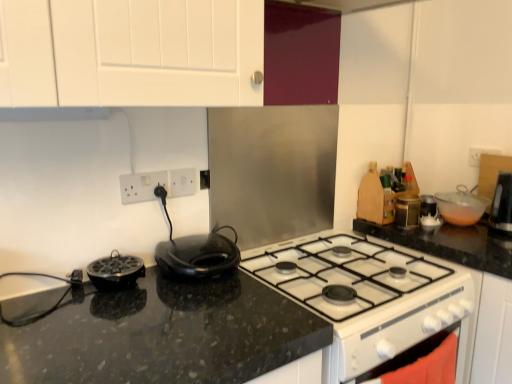
In order to face black granite countertop at center, should I rotate leftwards or rightwards?

To align with it, rotate right about 11.150°.

What do you see at coordinates (166, 335) in the screenshot? I see `black granite countertop at center` at bounding box center [166, 335].

This screenshot has width=512, height=384. In order to click on white glossy oven at lower right in this screenshot , I will do `click(409, 354)`.

Describe the element at coordinates (141, 186) in the screenshot. I see `white plastic electrical outlet at center-left, the 2th electric outlet in the right-to-left sequence` at that location.

This screenshot has width=512, height=384. What do you see at coordinates (115, 272) in the screenshot? I see `black matte waffle maker at lower left, arranged as the 3th kitchen appliance when viewed from the right` at bounding box center [115, 272].

Find the location of `black plastic toaster at center, positioned as the second kitchen appliance in left-to-right order`. black plastic toaster at center, positioned as the second kitchen appliance in left-to-right order is located at coordinates (198, 255).

From the image's perspective, is white plastic electric outlet at upper center, marked as the 1th electric outlet in a right-to-left arrangement, beneath white plastic electrical outlet at center-left, the 2th electric outlet in the right-to-left sequence?

Actually, white plastic electric outlet at upper center, marked as the 1th electric outlet in a right-to-left arrangement, appears above white plastic electrical outlet at center-left, the 2th electric outlet in the right-to-left sequence, in the image.

Does point (190, 189) appear closer or farther from the camera than point (164, 185)?

Point (190, 189).

Is white plastic electric outlet at upper center, the 2th electric outlet viewed from the left, facing towards white plastic electrical outlet at center-left, the 2th electric outlet in the right-to-left sequence?

No, white plastic electric outlet at upper center, the 2th electric outlet viewed from the left, is not facing towards white plastic electrical outlet at center-left, the 2th electric outlet in the right-to-left sequence.

How much distance is there between white plastic electric outlet at upper center, marked as the 1th electric outlet in a right-to-left arrangement, and white plastic electrical outlet at center-left, the 2th electric outlet in the right-to-left sequence?

white plastic electric outlet at upper center, marked as the 1th electric outlet in a right-to-left arrangement, and white plastic electrical outlet at center-left, the 2th electric outlet in the right-to-left sequence, are 8.40 centimeters apart from each other.

From the image's perspective, is black plastic toaster at center, arranged as the second kitchen appliance when viewed from the back, positioned above or below white frosted glass jar at upper right?

black plastic toaster at center, arranged as the second kitchen appliance when viewed from the back, is situated lower than white frosted glass jar at upper right in the image.

Between black plastic toaster at center, which is the second kitchen appliance from front to back, and white frosted glass jar at upper right, which one appears on the right side from the viewer's perspective?

white frosted glass jar at upper right.

How different are the orientations of black plastic toaster at center, arranged as the second kitchen appliance when viewed from the back, and white frosted glass jar at upper right in degrees?

The angular difference between black plastic toaster at center, arranged as the second kitchen appliance when viewed from the back, and white frosted glass jar at upper right is 90 degrees.

Which point is more distant from viewer, (194,257) or (431,216)?

The point (431,216) is behind.

Would you say black matte waffle maker at lower left, which is the first kitchen appliance from front to back, is a long distance from white plastic electrical outlet at center-left, the 2th electric outlet in the right-to-left sequence?

No, black matte waffle maker at lower left, which is the first kitchen appliance from front to back, is not far from white plastic electrical outlet at center-left, the 2th electric outlet in the right-to-left sequence.

From a real-world perspective, who is located lower, black matte waffle maker at lower left, which is the first kitchen appliance from front to back, or white plastic electrical outlet at center-left, the 2th electric outlet in the right-to-left sequence?

black matte waffle maker at lower left, which is the first kitchen appliance from front to back, is physically lower.

From the picture: Which object is wider, black matte waffle maker at lower left, arranged as the 3th kitchen appliance when viewed from the right, or white plastic electrical outlet at center-left, the first electric outlet positioned from the left?

Wider between the two is black matte waffle maker at lower left, arranged as the 3th kitchen appliance when viewed from the right.

Can you tell me how much black matte waffle maker at lower left, which ranks as the third kitchen appliance in back-to-front order, and white plastic electrical outlet at center-left, the 2th electric outlet in the right-to-left sequence, differ in facing direction?

The angular difference between black matte waffle maker at lower left, which ranks as the third kitchen appliance in back-to-front order, and white plastic electrical outlet at center-left, the 2th electric outlet in the right-to-left sequence, is 0.0012 degrees.

You are a GUI agent. You are given a task and a screenshot of the screen. Output one action in this format:
    pyautogui.click(x=<x>, y=<y>)
    Task: Click on the 1st electric outlet behind the white glossy oven at lower right, starting your count from the anchor
    Image resolution: width=512 pixels, height=384 pixels.
    Given the screenshot: What is the action you would take?
    pyautogui.click(x=141, y=186)

Which point is more distant from viewer, (372, 378) or (135, 198)?

The point (135, 198) is farther from the camera.

Is white glossy oven at lower right not near white plastic electrical outlet at center-left, the first electric outlet positioned from the left?

white glossy oven at lower right is near white plastic electrical outlet at center-left, the first electric outlet positioned from the left, not far away.

From a real-world perspective, which object stands above the other?

From a 3D spatial view, white plastic electrical outlet at center-left, the first electric outlet positioned from the left, is above.

Between black granite countertop at center and white plastic electrical outlet at center-left, the 2th electric outlet in the right-to-left sequence, which one is positioned in front?

white plastic electrical outlet at center-left, the 2th electric outlet in the right-to-left sequence, is closer to the camera.

In order to click on counter top below the white plastic electrical outlet at center-left, the 2th electric outlet in the right-to-left sequence (from a real-world perspective) in this screenshot , I will do `click(476, 286)`.

Could you tell me if black granite countertop at center is facing white plastic electrical outlet at center-left, the 2th electric outlet in the right-to-left sequence?

Yes, black granite countertop at center faces towards white plastic electrical outlet at center-left, the 2th electric outlet in the right-to-left sequence.

Would you say black granite countertop at center contains white plastic electrical outlet at center-left, the first electric outlet positioned from the left?

No, white plastic electrical outlet at center-left, the first electric outlet positioned from the left, is not a part of black granite countertop at center.

Considering the relative sizes of white glossy exhaust hood at upper center and white glossy oven at lower right in the image provided, is white glossy exhaust hood at upper center taller than white glossy oven at lower right?

No.

Considering the points (28, 108) and (368, 374), which point is in front, point (28, 108) or point (368, 374)?

Point (28, 108)

Based on the photo, from a real-world perspective, is white glossy exhaust hood at upper center below white glossy oven at lower right?

No, from a real-world perspective, white glossy exhaust hood at upper center is not under white glossy oven at lower right.

Which of these two, black plastic toaster at center, arranged as the second kitchen appliance when viewed from the back, or white plastic electric outlet at upper center, the 2th electric outlet viewed from the left, stands taller?

Standing taller between the two is white plastic electric outlet at upper center, the 2th electric outlet viewed from the left.

Is point (228, 257) positioned before point (192, 190)?

Yes, it is.

How much distance is there between black plastic toaster at center, which is the second kitchen appliance from front to back, and white plastic electric outlet at upper center, marked as the 1th electric outlet in a right-to-left arrangement?

8.61 inches.

Is the depth of black plastic toaster at center, which is the second kitchen appliance from front to back, greater than that of white plastic electric outlet at upper center, marked as the 1th electric outlet in a right-to-left arrangement?

No, it is not.

The height and width of the screenshot is (384, 512). I want to click on electric outlet behind the white plastic electrical outlet at center-left, the 2th electric outlet in the right-to-left sequence, so click(182, 182).

Starting from the white frosted glass jar at upper right, which kitchen appliance is the 1st one to the left? Please provide its 2D coordinates.

[(198, 255)]

When comparing their distances from white glossy exhaust hood at upper center, does white plastic electric outlet at upper center, marked as the 1th electric outlet in a right-to-left arrangement, or black granite countertop at center seem closer?

white plastic electric outlet at upper center, marked as the 1th electric outlet in a right-to-left arrangement, lies closer to white glossy exhaust hood at upper center than the other object.

Looking at the image, which one is located closer to white plastic electrical outlet at center-left, the 2th electric outlet in the right-to-left sequence, black plastic toaster at center, placed as the second kitchen appliance when sorted from right to left, or black matte waffle maker at lower left, which ranks as the third kitchen appliance in back-to-front order?

black matte waffle maker at lower left, which ranks as the third kitchen appliance in back-to-front order, is closer to white plastic electrical outlet at center-left, the 2th electric outlet in the right-to-left sequence.

Considering their positions, is white glossy oven at lower right positioned closer to black granite countertop at center than white plastic electrical outlet at center-left, the 2th electric outlet in the right-to-left sequence?

white glossy oven at lower right is closer to black granite countertop at center.

When comparing their distances from white glossy exhaust hood at upper center, does black granite countertop at center or white plastic electric outlet at upper center, marked as the 1th electric outlet in a right-to-left arrangement, seem closer?

The object closer to white glossy exhaust hood at upper center is white plastic electric outlet at upper center, marked as the 1th electric outlet in a right-to-left arrangement.

When comparing their distances from white glossy oven at lower right, does black granite countertop at center or white frosted glass jar at upper right seem further?

white frosted glass jar at upper right lies further to white glossy oven at lower right than the other object.

From the image, which object appears to be nearer to white frosted glass jar at upper right, black plastic toaster at center, positioned as the second kitchen appliance in left-to-right order, or white plastic electric outlet at upper center, marked as the 1th electric outlet in a right-to-left arrangement?

Among the two, black plastic toaster at center, positioned as the second kitchen appliance in left-to-right order, is located nearer to white frosted glass jar at upper right.

When comparing their distances from white plastic electric outlet at upper center, the 2th electric outlet viewed from the left, does white frosted glass jar at upper right or black granite countertop at center seem further?

Among the two, white frosted glass jar at upper right is located further to white plastic electric outlet at upper center, the 2th electric outlet viewed from the left.

Which object lies nearer to the anchor point white glossy exhaust hood at upper center, black granite countertop at center or black matte waffle maker at lower left, which ranks as the third kitchen appliance in back-to-front order?

black matte waffle maker at lower left, which ranks as the third kitchen appliance in back-to-front order.

Locate an element on the screen. kitchen appliance between white plastic electrical outlet at center-left, the first electric outlet positioned from the left, and white frosted glass jar at upper right from left to right is located at coordinates (198, 255).

Find the location of a particular element. Image resolution: width=512 pixels, height=384 pixels. countertop between white plastic electrical outlet at center-left, the 2th electric outlet in the right-to-left sequence, and white frosted glass jar at upper right from left to right is located at coordinates (166, 335).

Locate an element on the screen. oven between white glossy exhaust hood at upper center and black granite countertop at center from left to right is located at coordinates (409, 354).

This screenshot has height=384, width=512. In order to click on counter top between white glossy oven at lower right and transparent plastic bowl at upper right, arranged as the first kitchen appliance when viewed from the right, in the front-back direction in this screenshot , I will do `click(476, 286)`.